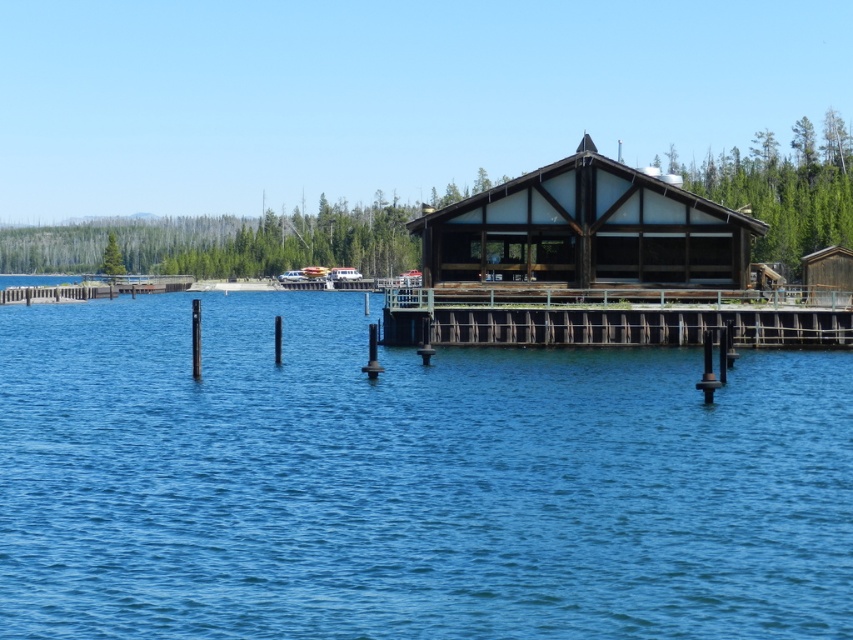
Question: Which object is positioned farthest from the metallic silver boat at center?

Choices:
 (A) white plastic boat at center
 (B) brown wooden dock at center
 (C) wooden cabin at center
 (D) blue water at center

Answer: (B)

Question: Which object is farther from the camera taking this photo?

Choices:
 (A) metallic silver boat at center
 (B) wooden cabin at center
 (C) brown wooden dock at center
 (D) white plastic boat at center

Answer: (D)

Question: Considering the relative positions of brown wooden dock at center and metallic silver boat at center in the image provided, where is brown wooden dock at center located with respect to metallic silver boat at center?

Choices:
 (A) above
 (B) below

Answer: (B)

Question: Can you confirm if white plastic boat at center is wider than metallic silver boat at center?

Choices:
 (A) yes
 (B) no

Answer: (B)

Question: Among these points, which one is farthest from the camera?

Choices:
 (A) (201, 380)
 (B) (454, 275)
 (C) (843, 323)
 (D) (303, 280)

Answer: (D)

Question: In this image, where is white plastic boat at center located relative to metallic silver boat at center?

Choices:
 (A) below
 (B) above

Answer: (B)